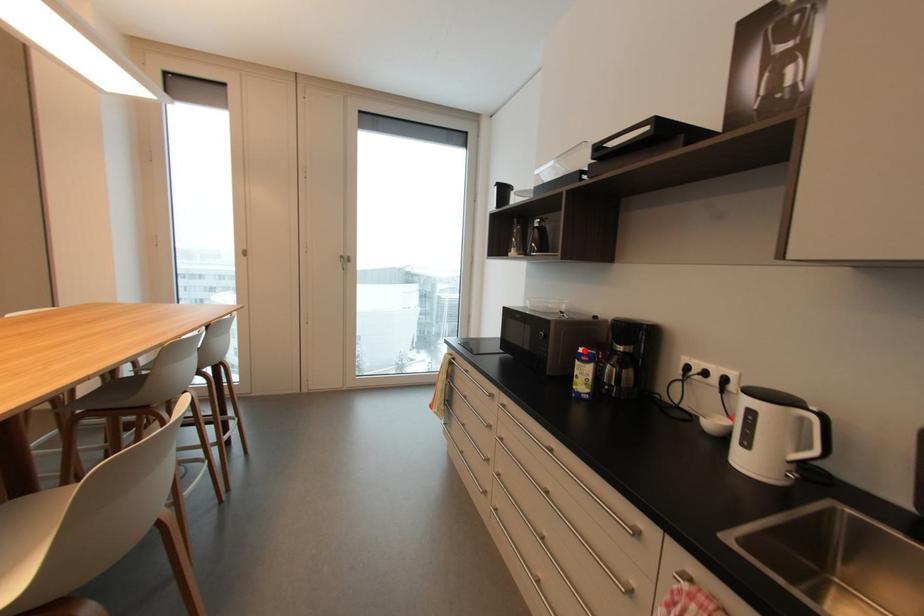
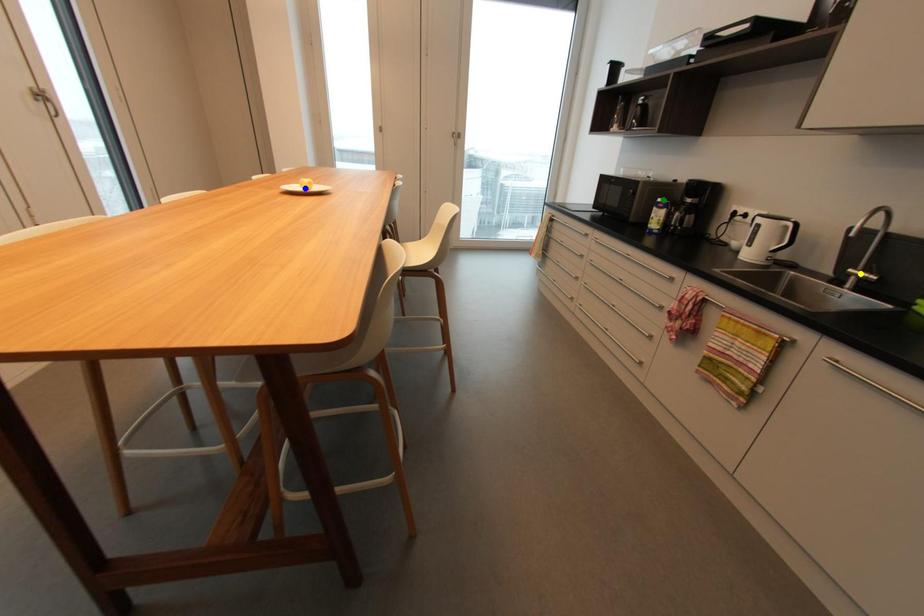
Question: I am providing you with two images of the same scene from different viewpoints. A red point is marked on the first image. You are given multiple points on the second image. Which spot in image 2 lines up with the point in image 1?

Choices:
 (A) green point
 (B) yellow point
 (C) blue point

Answer: (A)